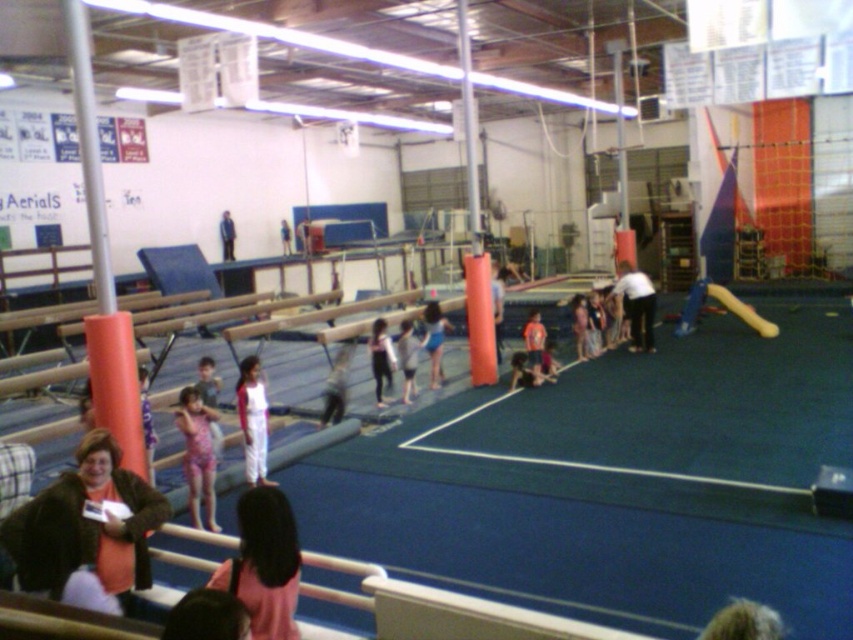
Which is behind, point (257, 432) or point (538, 340)?

The point (538, 340) is behind.

Can you confirm if white cotton pants at center is shorter than orange fabric shorts at center?

In fact, white cotton pants at center may be taller than orange fabric shorts at center.

Identify the location of white cotton pants at center. The width and height of the screenshot is (853, 640). (252, 419).

Is blue fabric at center in front of orange fabric shorts at center?

Yes, it is in front of orange fabric shorts at center.

Is blue fabric at center above orange fabric shorts at center?

No, blue fabric at center is not above orange fabric shorts at center.

Describe the element at coordinates (434, 340) in the screenshot. I see `blue fabric at center` at that location.

At what (x,y) coordinates should I click in order to perform the action: click on blue fabric at center. Please return your answer as a coordinate pair (x, y). The width and height of the screenshot is (853, 640). Looking at the image, I should click on [434, 340].

Between matte black jacket at lower left and white matte shirt at center, which one has less height?

With less height is matte black jacket at lower left.

Which is in front, point (160, 516) or point (619, 288)?

Point (160, 516)

This screenshot has height=640, width=853. Identify the location of matte black jacket at lower left. (86, 525).